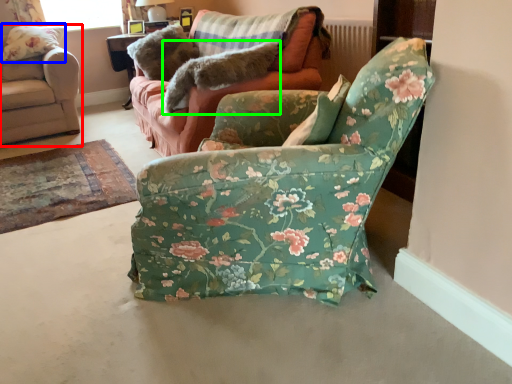
Question: Which is farther away from chair (highlighted by a red box)? pillow (highlighted by a blue box) or animal (highlighted by a green box)?

Choices:
 (A) pillow
 (B) animal

Answer: (B)